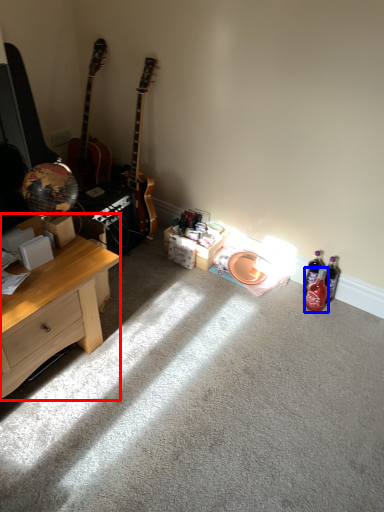
Question: Which object is further to the camera taking this photo, desk (highlighted by a red box) or bottle (highlighted by a blue box)?

Choices:
 (A) desk
 (B) bottle

Answer: (B)